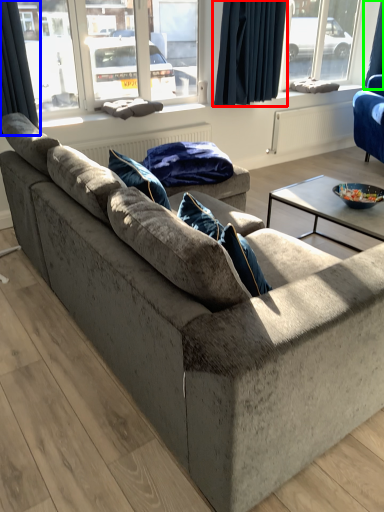
Question: Which object is the farthest from curtain (highlighted by a red box)? Choose among these: curtain (highlighted by a blue box) or curtain (highlighted by a green box).

Choices:
 (A) curtain
 (B) curtain

Answer: (B)